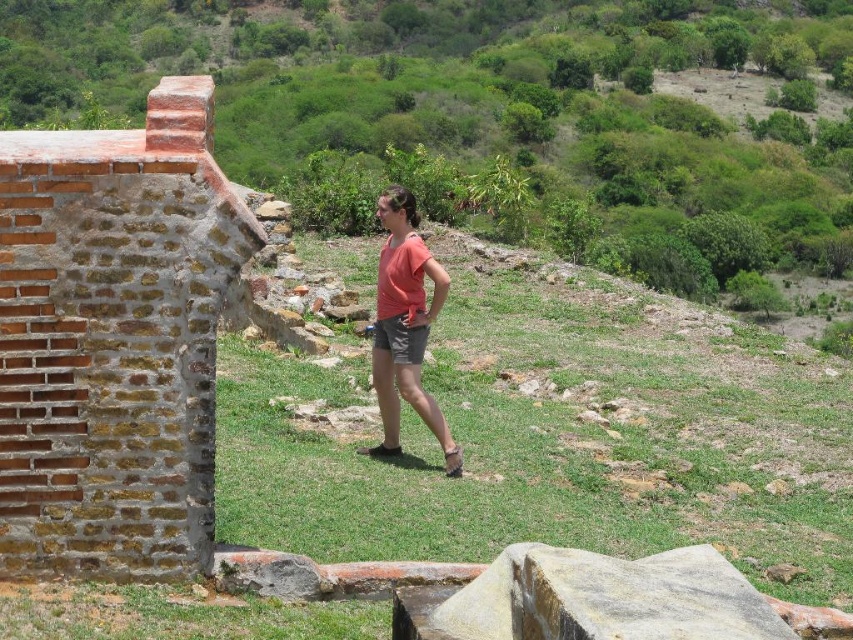
Question: Is green grassy at center positioned before matte coral t-shirt at center?

Choices:
 (A) no
 (B) yes

Answer: (B)

Question: Is matte coral t-shirt at center bigger than gray cotton shorts at center?

Choices:
 (A) no
 (B) yes

Answer: (A)

Question: Which point is farther from the camera taking this photo?

Choices:
 (A) (401, 342)
 (B) (692, 481)
 (C) (422, 413)

Answer: (B)

Question: Is green grassy at center below matte coral t-shirt at center?

Choices:
 (A) yes
 (B) no

Answer: (B)

Question: Which object is closer to the camera taking this photo?

Choices:
 (A) matte coral t-shirt at center
 (B) gray cotton shorts at center
 (C) green grassy at center

Answer: (C)

Question: Which of these objects is positioned farthest from the green grassy at center?

Choices:
 (A) matte coral t-shirt at center
 (B) gray cotton shorts at center

Answer: (A)